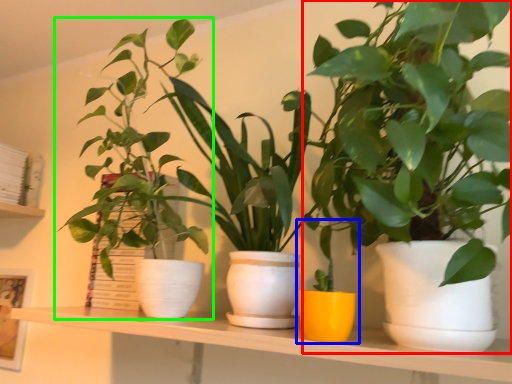
Question: Estimate the real-world distances between objects in this image. Which object is farther from houseplant (highlighted by a red box), houseplant (highlighted by a blue box) or houseplant (highlighted by a green box)?

Choices:
 (A) houseplant
 (B) houseplant

Answer: (B)